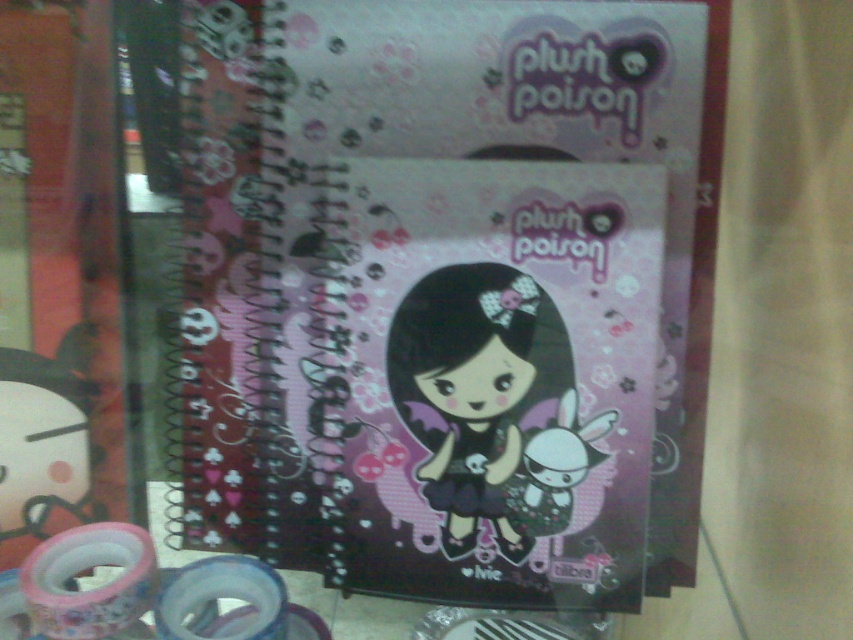
You are organizing a shelf and need to place the matte pink notebook at center and the matte black doll at center. Since the shelf has limited vertical space, which item should you place first to ensure both fit vertically?

The matte black doll at center should be placed first because the matte pink notebook at center is much taller, so placing the shorter doll first allows the taller notebook to fit above it within the vertical space constraints.

You are an interior designer planning to place a decorative item on a shelf. The shelf has a coordinate system where the bottom left corner is the origin point. The shelf is 1 meter wide and 1 meter tall. You have a matte pink notebook at center that you want to place. Where should you position it to match the coordinates given in the scene?

The matte pink notebook at center should be positioned at coordinates point [450,291] to match the scene.

You are organizing a shelf in a gift shop and need to place the matte pink notebook at center and the matte black doll at center. According to the image, which item is placed on top of the other?

The matte pink notebook at center is positioned over the matte black doll at center, so the notebook is on top of the doll.